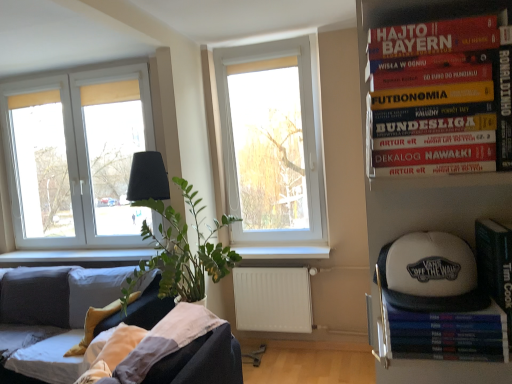
Find the location of a particular element. empty space that is ontop of white wood window sill at center (from a real-world perspective) is located at coordinates (284, 249).